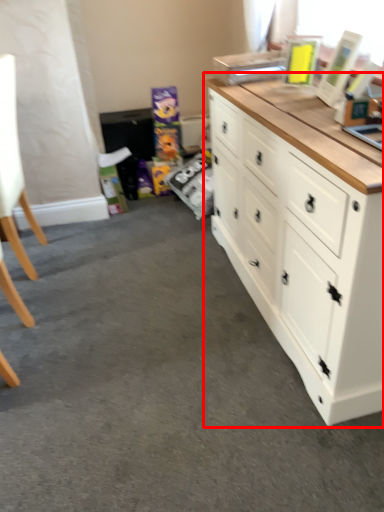
Question: From the image's perspective, where is chest of drawers (annotated by the red box) located relative to swivel chair?

Choices:
 (A) above
 (B) below

Answer: (B)